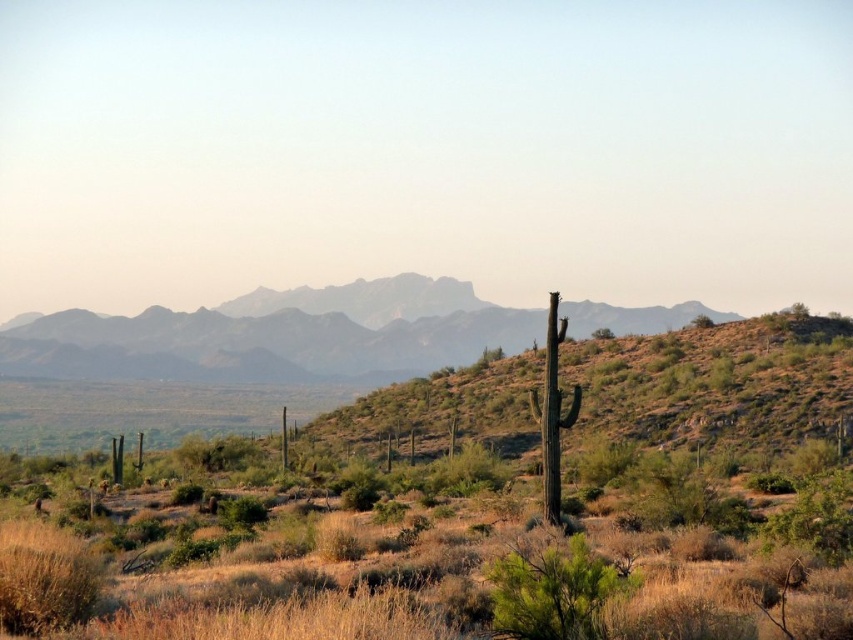
You are standing in the desert landscape and want to determine which point is closer to you. Which point, point (526, 560) or point (265, 365), is closer to your current position?

Point (526, 560) is closer to the camera than point (265, 365), so it is closer to your current position.

You are a hiker planning to cross the desert and need to navigate between the green shrubbery at center and the gray rocky mountain range at center. Which of these two landmarks is taller and would be visible from a greater distance?

The gray rocky mountain range at center is taller than the green shrubbery at center, so it would be visible from a greater distance.

You are standing in the desert and see the green shrubbery at center and the gray rocky mountain range at center. Which one is positioned to the left from your perspective?

The green shrubbery at center is positioned to the left of the gray rocky mountain range at center.